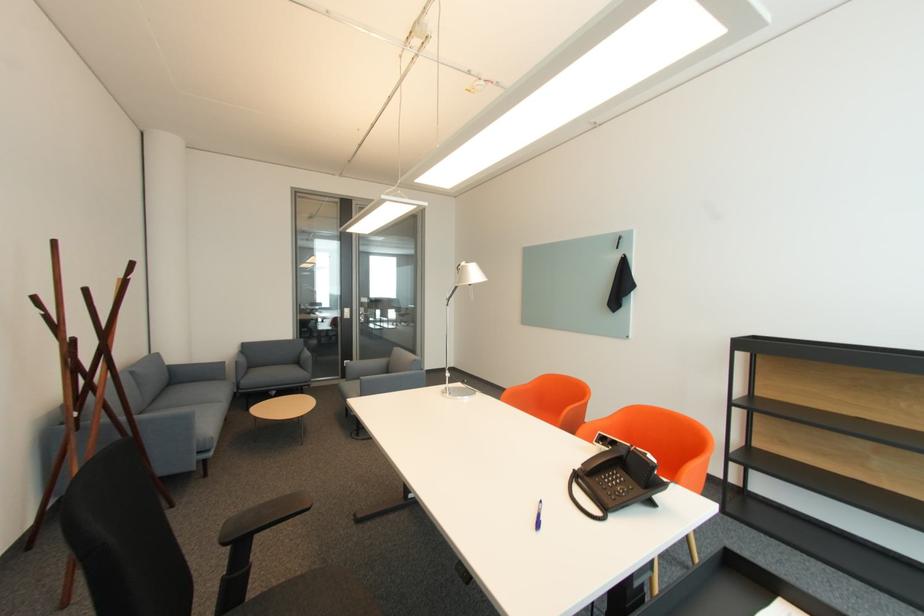
Where is `chair sitting surface`? The height and width of the screenshot is (616, 924). chair sitting surface is located at coordinates (277, 370).